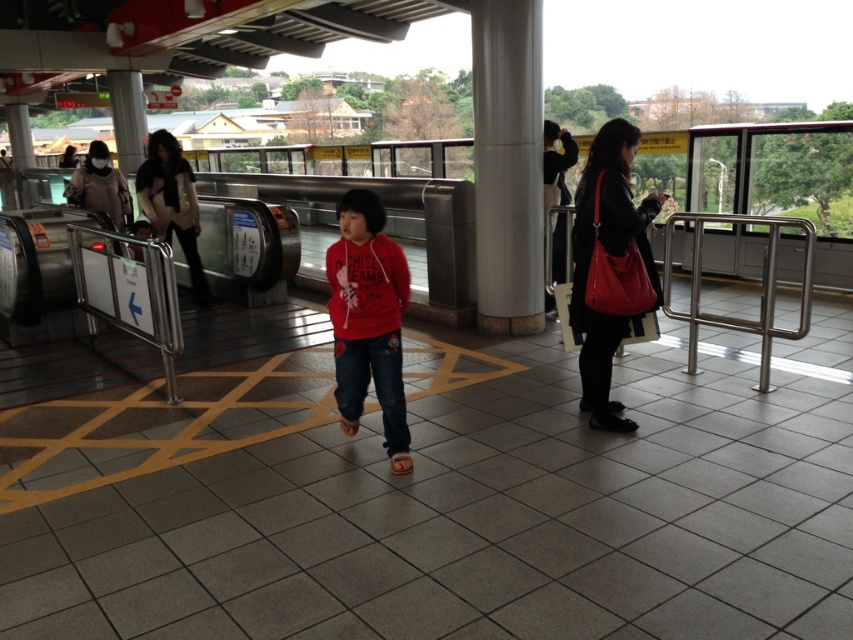
Question: Does matte black handbag at center right come behind white fur coat at left?

Choices:
 (A) yes
 (B) no

Answer: (B)

Question: Which point is closer to the camera?

Choices:
 (A) (621, 285)
 (B) (96, 179)
 (C) (737, 218)

Answer: (A)

Question: Which point is closer to the camera taking this photo?

Choices:
 (A) (805, 326)
 (B) (115, 173)
 (C) (357, 211)
 (D) (164, 173)

Answer: (C)

Question: Which point is farther to the camera?

Choices:
 (A) matte red hoodie at center
 (B) metallic silver rail at left
 (C) satin silver rail at right

Answer: (B)

Question: Is white fur coat at left closer to the viewer compared to matte black jacket at upper left?

Choices:
 (A) yes
 (B) no

Answer: (A)

Question: Can you confirm if metallic silver rail at left is thinner than matte black jacket at upper left?

Choices:
 (A) yes
 (B) no

Answer: (A)